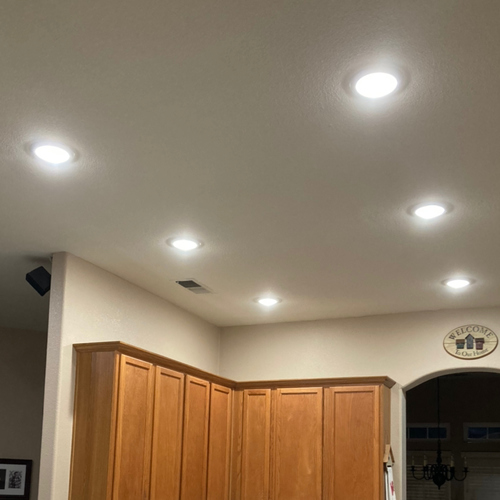
I want to click on cabinets, so click(x=144, y=435), click(x=196, y=443), click(x=257, y=443), click(x=334, y=441), click(x=166, y=437), click(x=219, y=449), click(x=293, y=446).